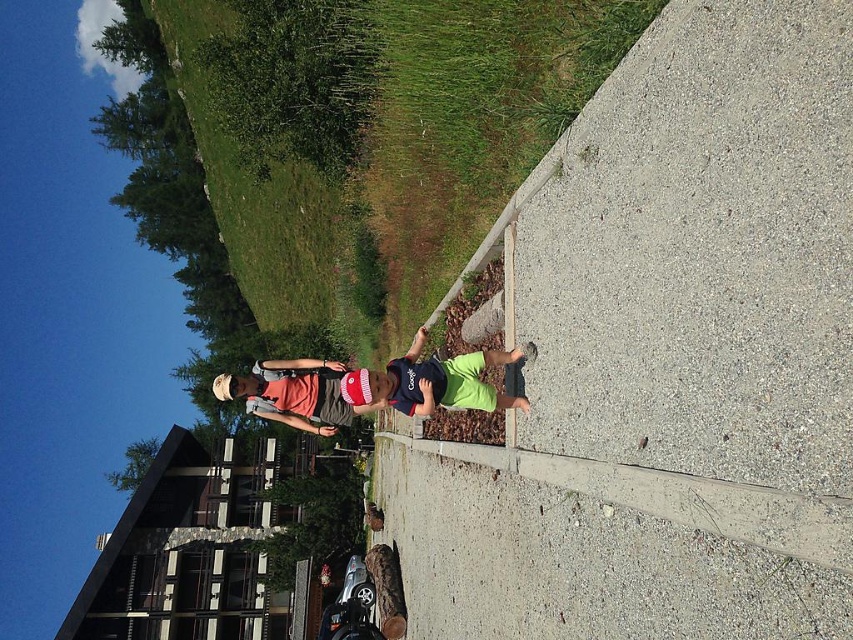
Is gray concrete at center shorter than matte red cap at center?

No.

Identify the location of gray concrete at center. This screenshot has width=853, height=640. (663, 358).

The image size is (853, 640). Identify the location of gray concrete at center. (663, 358).

Can you confirm if dark blue jersey at center is positioned to the right of matte red cap at center?

Indeed, dark blue jersey at center is positioned on the right side of matte red cap at center.

Who is positioned more to the right, dark blue jersey at center or matte red cap at center?

Positioned to the right is dark blue jersey at center.

Is point (463, 372) positioned before point (286, 410)?

Yes, it is in front of point (286, 410).

I want to click on dark blue jersey at center, so click(444, 381).

Locate an element on the screen. Image resolution: width=853 pixels, height=640 pixels. gray concrete at center is located at coordinates (663, 358).

Between point (791, 195) and point (523, 353), which one is positioned behind?

The point (523, 353) is more distant.

Where is `gray concrete at center`? The width and height of the screenshot is (853, 640). gray concrete at center is located at coordinates (663, 358).

Where is `gray concrete at center`? This screenshot has height=640, width=853. gray concrete at center is located at coordinates (663, 358).